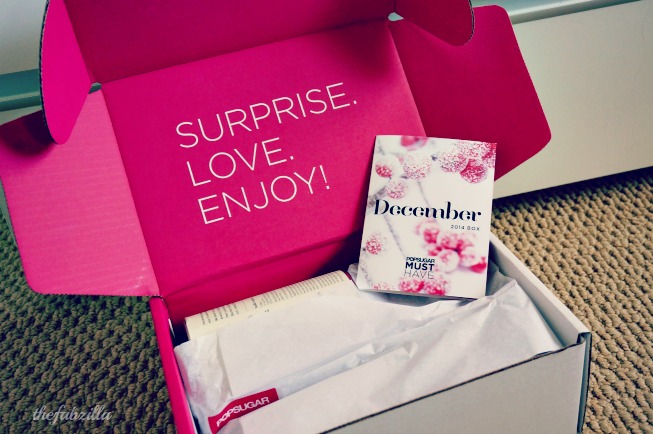
The image size is (653, 434). I want to click on box cover, so click(x=183, y=86).